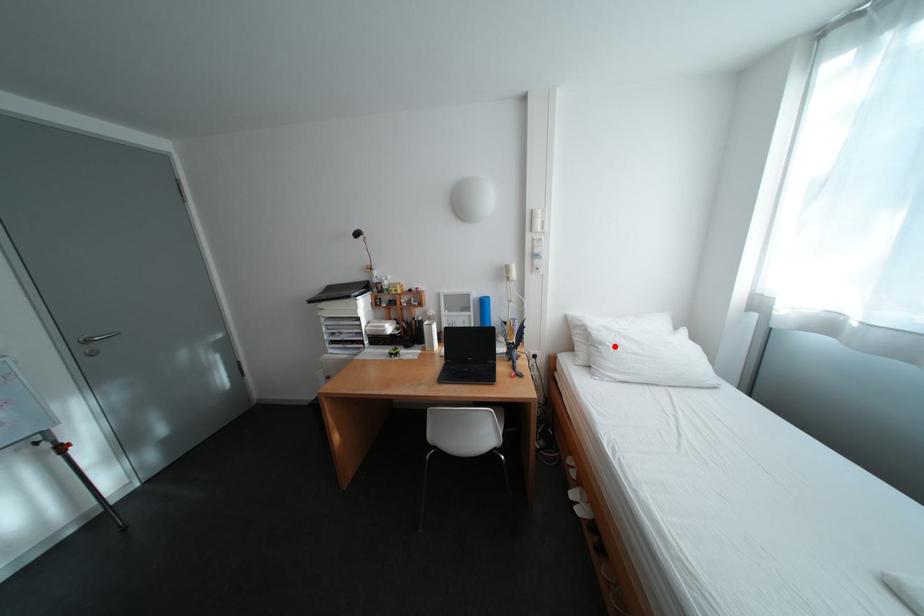
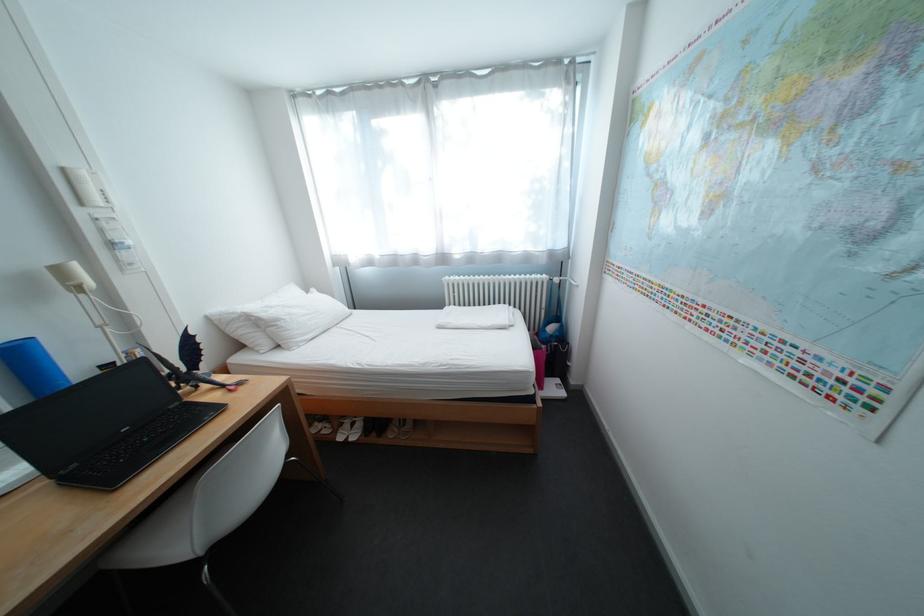
Question: I am providing you with two images of the same scene from different viewpoints. Image1 has a red point marked. In image2, the corresponding 3D location appears at what relative position? Reply with the corresponding letter.

Choices:
 (A) Closer
 (B) Farther

Answer: (A)